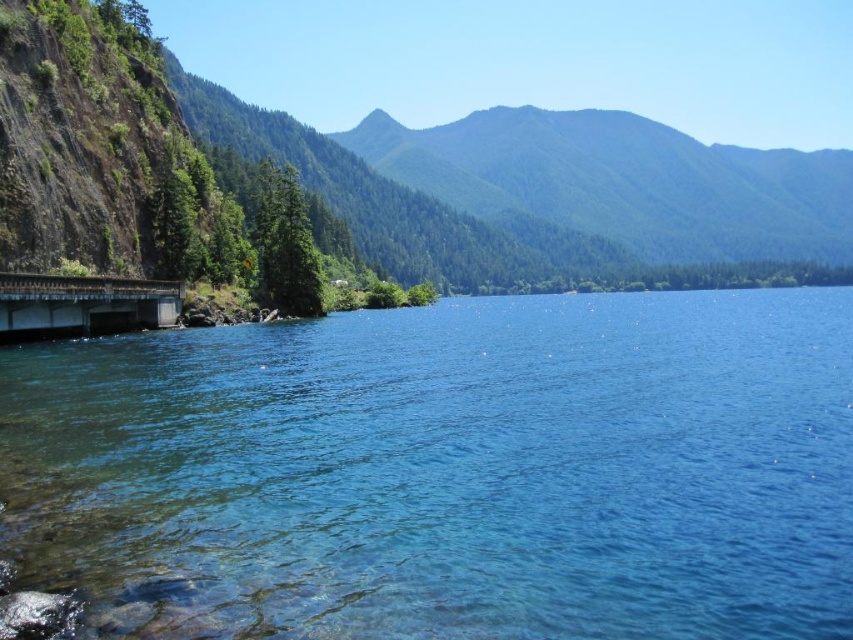
Who is positioned more to the right, green forested mountain at upper center or rusty metal bridge at lower left?

From the viewer's perspective, green forested mountain at upper center appears more on the right side.

Does point (775, 240) come closer to viewer compared to point (70, 328)?

No, it is behind (70, 328).

Is point (62, 186) more distant than point (13, 294)?

Yes.

Where is `green forested mountain at upper center`? green forested mountain at upper center is located at coordinates (403, 177).

Can you confirm if clear blue water at lower left is wider than rusty metal bridge at lower left?

Yes.

Describe the element at coordinates (445, 472) in the screenshot. I see `clear blue water at lower left` at that location.

Identify the location of clear blue water at lower left. The height and width of the screenshot is (640, 853). (445, 472).

Which is behind, point (233, 426) or point (132, 113)?

The point (132, 113) is more distant.

Where is `clear blue water at lower left`? clear blue water at lower left is located at coordinates (445, 472).

Is point (131, 563) positioned behind point (582, 243)?

No, (131, 563) is in front of (582, 243).

Locate an element on the screen. Image resolution: width=853 pixels, height=640 pixels. clear blue water at lower left is located at coordinates (445, 472).